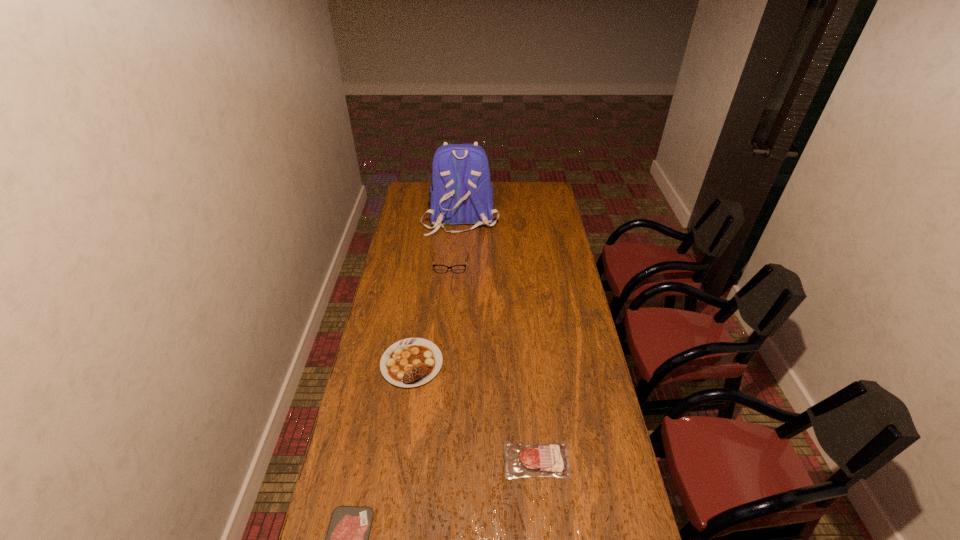
Choose which object is the fourth nearest neighbor to the farthest steak. Please provide its 2D coordinates. Your answer should be formatted as a tuple, i.e. [(x, y)], where the tuple contains the x and y coordinates of a point satisfying the conditions above.

[(462, 193)]

What are the coordinates of `steak that stands as the closest to the fourth nearest object` in the screenshot? It's located at (411, 362).

Identify which steak is the second closest to the nearest steak. Please provide its 2D coordinates. Your answer should be formatted as a tuple, i.e. [(x, y)], where the tuple contains the x and y coordinates of a point satisfying the conditions above.

[(411, 362)]

Where is `vacant area that satisfies the following two spatial constraints: 1. on the back of the second nearest object; 2. on the right side of the tallest object`? vacant area that satisfies the following two spatial constraints: 1. on the back of the second nearest object; 2. on the right side of the tallest object is located at coordinates (446, 460).